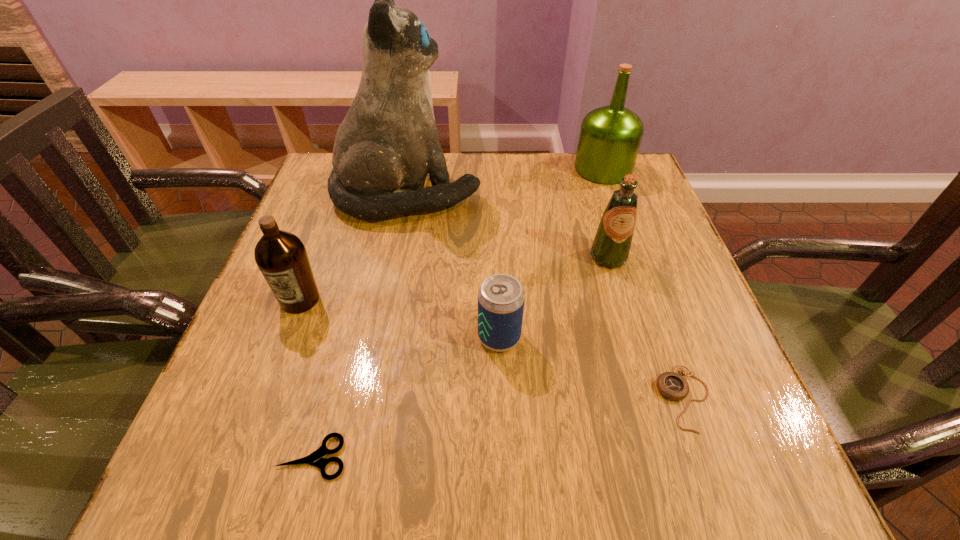
Locate an element on the screen. The image size is (960, 540). the nearest object is located at coordinates (315, 459).

I want to click on shears, so click(x=315, y=459).

Locate an element on the screen. This screenshot has width=960, height=540. vacant point located at the face of the tallest object is located at coordinates (638, 194).

Identify the location of free space located 0.400m on the left of the farthest olive oil. This screenshot has height=540, width=960. (427, 169).

This screenshot has height=540, width=960. What are the coordinates of `free region located 0.390m on the front-facing side of the fifth nearest object` in the screenshot? It's located at (667, 457).

You are a GUI agent. You are given a task and a screenshot of the screen. Output one action in this format:
    pyautogui.click(x=<x>, y=<y>)
    Task: Click on the free spot located 0.310m on the label of the leftmost olive oil
    This screenshot has width=960, height=540.
    Given the screenshot: What is the action you would take?
    pyautogui.click(x=229, y=488)

In order to click on free spot located on the back of the beer can in this screenshot , I will do `click(497, 275)`.

You are a GUI agent. You are given a task and a screenshot of the screen. Output one action in this format:
    pyautogui.click(x=<x>, y=<y>)
    Task: Click on the vacant region located 0.060m on the left of the pocket watch
    This screenshot has width=960, height=540.
    Given the screenshot: What is the action you would take?
    pyautogui.click(x=623, y=399)

You are a GUI agent. You are given a task and a screenshot of the screen. Output one action in this format:
    pyautogui.click(x=<x>, y=<y>)
    Task: Click on the vacant region located on the right of the shears
    
    Given the screenshot: What is the action you would take?
    pyautogui.click(x=461, y=457)

Find the location of a particular element. The height and width of the screenshot is (540, 960). cat that is at the far edge is located at coordinates (388, 142).